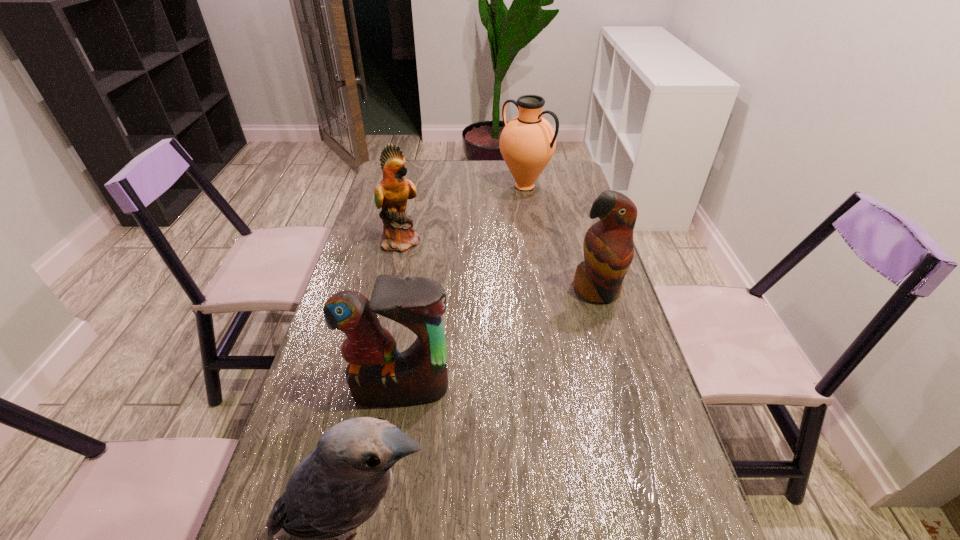
Where is `pitcher that is at the right edge`? The width and height of the screenshot is (960, 540). pitcher that is at the right edge is located at coordinates (527, 143).

The image size is (960, 540). Find the location of `parrot that is at the right edge`. parrot that is at the right edge is located at coordinates (608, 247).

The width and height of the screenshot is (960, 540). In order to click on object at the far right corner in this screenshot , I will do [x=527, y=143].

What are the coordinates of `free space at the far edge of the desktop` in the screenshot? It's located at (423, 179).

The width and height of the screenshot is (960, 540). What are the coordinates of `free location at the left edge of the desktop` in the screenshot? It's located at (345, 403).

Where is `vacant space at the right edge of the desktop`? The width and height of the screenshot is (960, 540). vacant space at the right edge of the desktop is located at coordinates (614, 447).

The width and height of the screenshot is (960, 540). In the image, there is a desktop. In order to click on free space at the far left corner in this screenshot , I will do `click(416, 174)`.

Where is `free spot between the fourth farthest object and the pitcher`? The width and height of the screenshot is (960, 540). free spot between the fourth farthest object and the pitcher is located at coordinates (463, 288).

Locate an element on the screen. empty space between the third nearest object and the second farthest object is located at coordinates [499, 266].

The image size is (960, 540). What are the coordinates of `vacant area between the second farthest object and the farthest object` in the screenshot? It's located at (464, 213).